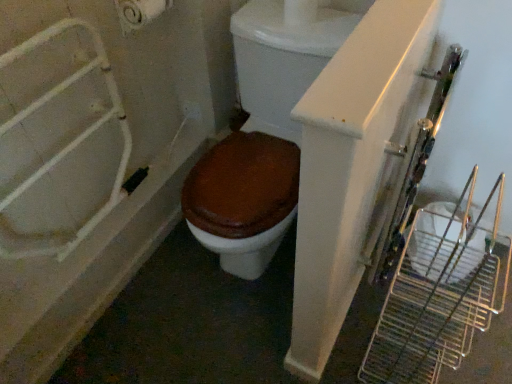
Where is `vacant area on top of white glossy bathtub at left (from a real-world perspective)`? vacant area on top of white glossy bathtub at left (from a real-world perspective) is located at coordinates (106, 224).